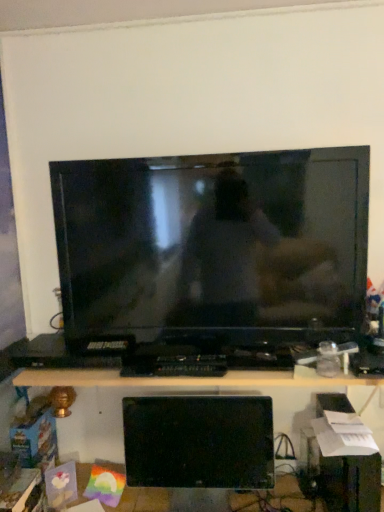
Where is `black glossy monitor at lower center`? black glossy monitor at lower center is located at coordinates (199, 442).

Find the location of `matte black television at center`. matte black television at center is located at coordinates (213, 246).

This screenshot has width=384, height=512. Find the location of `black glossy monitor at lower center`. black glossy monitor at lower center is located at coordinates (199, 442).

Can you tell me how much matte black television at center and black glossy monitor at lower center differ in facing direction?

The angle between the facing direction of matte black television at center and the facing direction of black glossy monitor at lower center is 1.95 degrees.

Is matte black television at center spatially inside black glossy monitor at lower center, or outside of it?

matte black television at center cannot be found inside black glossy monitor at lower center.

Based on the photo, from the image's perspective, is matte black television at center above or below black glossy monitor at lower center?

Based on their image positions, matte black television at center is located above black glossy monitor at lower center.

Are black plastic desk at lower center and matte black television at center located far from each other?

No, there isn't a large distance between black plastic desk at lower center and matte black television at center.

Is black plastic desk at lower center looking in the opposite direction of matte black television at center?

No.

How many degrees apart are the facing directions of black plastic desk at lower center and matte black television at center?

They differ by 0.00284 degrees in their facing directions.

Can you confirm if black plastic desk at lower center is shorter than matte black television at center?

Yes, black plastic desk at lower center is shorter than matte black television at center.

How different are the orientations of black glossy monitor at lower center and matte black television at center in degrees?

black glossy monitor at lower center and matte black television at center are facing 1.95 degrees away from each other.

Can you see black glossy monitor at lower center touching matte black television at center?

No, black glossy monitor at lower center is not next to matte black television at center.

Could you tell me if black glossy monitor at lower center is facing matte black television at center?

No, black glossy monitor at lower center is not facing towards matte black television at center.

From a real-world perspective, is black glossy monitor at lower center on matte black television at center?

A: No, from a real-world perspective, black glossy monitor at lower center is not above matte black television at center.

From a real-world perspective, is black glossy monitor at lower center physically located above or below black plastic desk at lower center?

black glossy monitor at lower center is situated lower than black plastic desk at lower center in the real world.

Is black glossy monitor at lower center at the right side of black plastic desk at lower center?

Incorrect, black glossy monitor at lower center is not on the right side of black plastic desk at lower center.

Would you say black glossy monitor at lower center is inside or outside black plastic desk at lower center?

The correct answer is: inside.

From the picture: Which object is closer to the camera taking this photo, black glossy monitor at lower center or black plastic desk at lower center?

black plastic desk at lower center.

Between black plastic desk at lower center and black glossy monitor at lower center, which one has smaller width?

With smaller width is black glossy monitor at lower center.

Relative to black glossy monitor at lower center, is black plastic desk at lower center in front or behind?

Clearly, black plastic desk at lower center is in front of black glossy monitor at lower center.

Considering the positions of points (76, 372) and (204, 481), is point (76, 372) farther from camera compared to point (204, 481)?

No.

Could you tell me if black plastic desk at lower center is facing black glossy monitor at lower center?

No.

Is matte black television at center positioned with its back to black plastic desk at lower center?

That's not correct — matte black television at center is not looking away from black plastic desk at lower center.

Is matte black television at center situated inside black plastic desk at lower center or outside?

The correct answer is: outside.

Is matte black television at center at the left side of black plastic desk at lower center?

Correct, you'll find matte black television at center to the left of black plastic desk at lower center.

The height and width of the screenshot is (512, 384). I want to click on desk that is in front of the matte black television at center, so click(x=185, y=381).

Find the location of `television on the right of black glossy monitor at lower center`. television on the right of black glossy monitor at lower center is located at coordinates (213, 246).

The height and width of the screenshot is (512, 384). What are the coordinates of `television above the black plastic desk at lower center (from the image's perspective)` in the screenshot? It's located at point(213,246).

Based on the photo, looking at the image, which one is located closer to matte black television at center, black plastic desk at lower center or black glossy monitor at lower center?

Result: black plastic desk at lower center is positioned closer to the anchor matte black television at center.

Based on their spatial positions, is matte black television at center or black plastic desk at lower center closer to black glossy monitor at lower center?

Based on the image, black plastic desk at lower center appears to be nearer to black glossy monitor at lower center.

When comparing their distances from black plastic desk at lower center, does black glossy monitor at lower center or matte black television at center seem further?

matte black television at center is positioned further to the anchor black plastic desk at lower center.

Based on their spatial positions, is black glossy monitor at lower center or black plastic desk at lower center further from matte black television at center?

Among the two, black glossy monitor at lower center is located further to matte black television at center.

From the image, which object appears to be farther from black plastic desk at lower center, matte black television at center or black glossy monitor at lower center?

matte black television at center.

When comparing their distances from black glossy monitor at lower center, does black plastic desk at lower center or matte black television at center seem closer?

black plastic desk at lower center is closer to black glossy monitor at lower center.

Find the location of a particular element. This screenshot has width=384, height=512. desk between matte black television at center and black glossy monitor at lower center in the up-down direction is located at coordinates (185, 381).